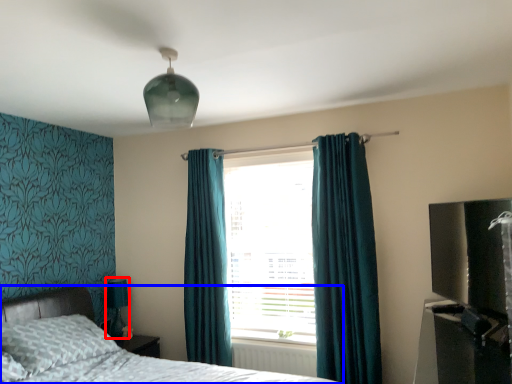
Question: Which object appears closest to the camera in this image, table lamp (highlighted by a red box) or bed (highlighted by a blue box)?

Choices:
 (A) table lamp
 (B) bed

Answer: (B)